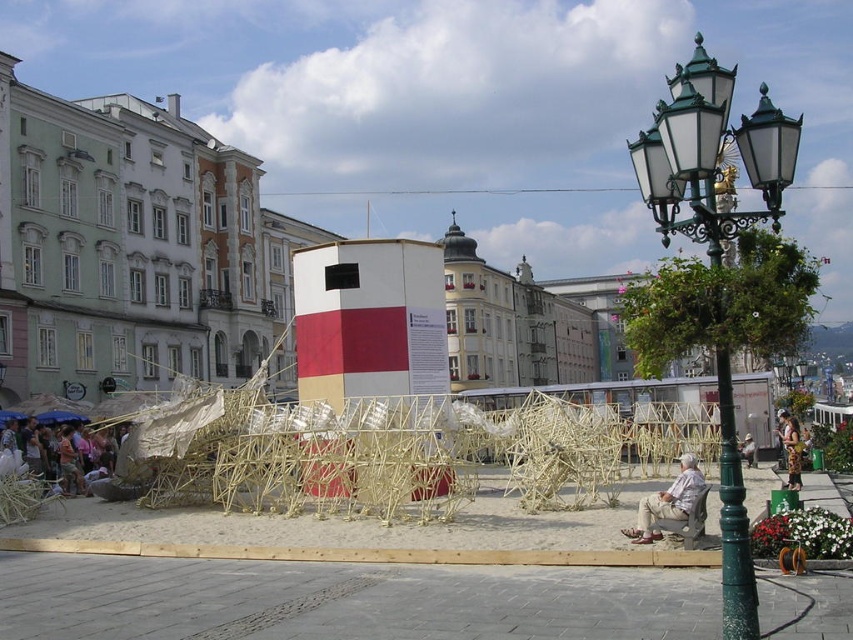
You are a city planner assessing the urban square. You need to determine if the green metal streetlight at right can be replaced with a new, larger model without affecting the light brown fabric at lower left. Based on their sizes, what should you consider?

The green metal streetlight at right is larger than the light brown fabric at lower left. Replacing it with a larger model might reduce the available space near the light brown fabric at lower left, potentially affecting it.